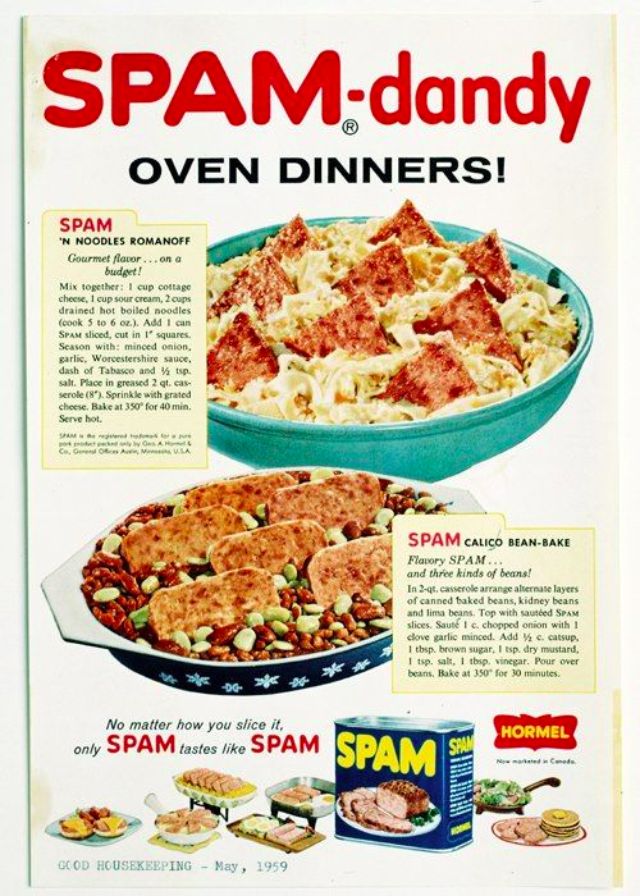
Locate an element on the screen. This screenshot has width=640, height=896. oven is located at coordinates (211, 177).